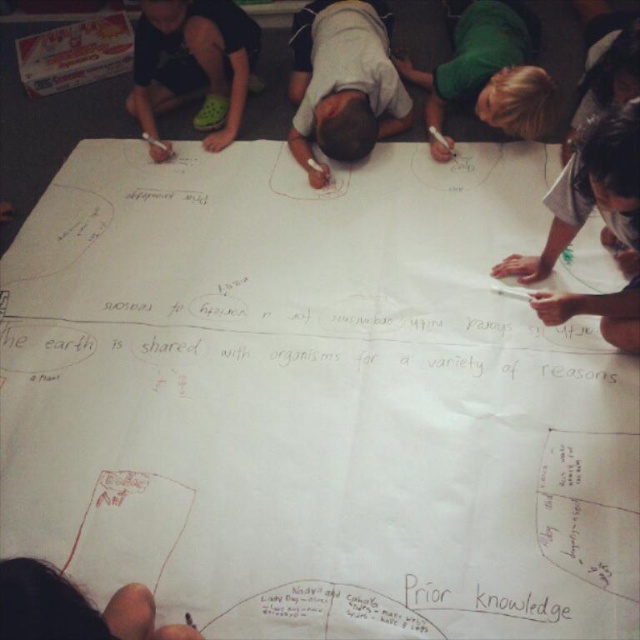
Question: Can you confirm if matte black shirt at upper left is positioned below green matte shirt at upper right?

Choices:
 (A) yes
 (B) no

Answer: (A)

Question: Which of the following is the farthest from the observer?

Choices:
 (A) dark gray shirt at lower right
 (B) black paper knowledge at lower center

Answer: (B)

Question: Observing the image, what is the correct spatial positioning of dark gray shirt at lower right in reference to green matte shirt at upper right?

Choices:
 (A) above
 (B) below

Answer: (B)

Question: Estimate the real-world distances between objects in this image. Which object is closer to the black paper knowledge at lower center?

Choices:
 (A) white matte shirt at center
 (B) green matte shirt at upper right

Answer: (A)

Question: Is white matte shirt at center to the right of dark gray shirt at lower right from the viewer's perspective?

Choices:
 (A) yes
 (B) no

Answer: (B)

Question: Which point appears farthest from the camera in this image?

Choices:
 (A) (636, 273)
 (B) (506, 614)

Answer: (A)